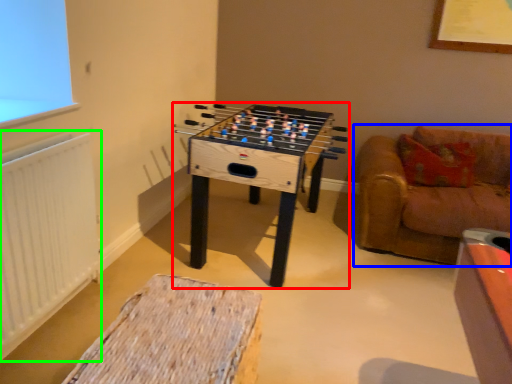
Question: Considering the real-world distances, which object is closest to table (highlighted by a red box)? studio couch (highlighted by a blue box) or radiator (highlighted by a green box).

Choices:
 (A) studio couch
 (B) radiator

Answer: (A)